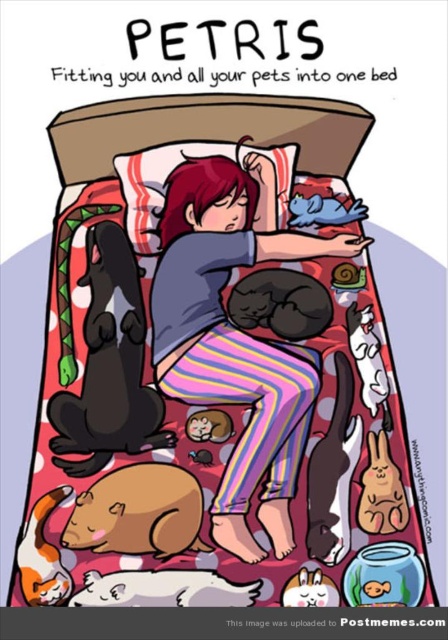
You are a pet owner who wants to ensure all your pets can comfortably sleep on the bed with you. Given the bed has a height requirement of 1.5 meters, can the matte blue shirt at center and the black fur dog at lower left both fit vertically on the bed?

The matte blue shirt at center is much taller than the black fur dog at lower left. However, without knowing their exact heights, we cannot confirm if they both meet the 1.5 meter bed height requirement.

You are trying to figure out the arrangement of the pets on the bed. According to the scene, where is the black fur dog at lower left in relation to the white fur cat at lower left?

The black fur dog at lower left is located above the white fur cat at lower left.

You are trying to locate the matte blue shirt at center in the image. According to the coordinates given, where exactly is it positioned?

The matte blue shirt at center is located at point (236, 337) in the coordinate system provided.